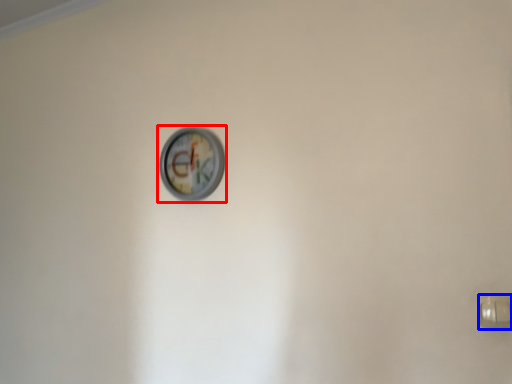
Question: Which object is further to the camera taking this photo, wall clock (highlighted by a red box) or door handle (highlighted by a blue box)?

Choices:
 (A) wall clock
 (B) door handle

Answer: (A)